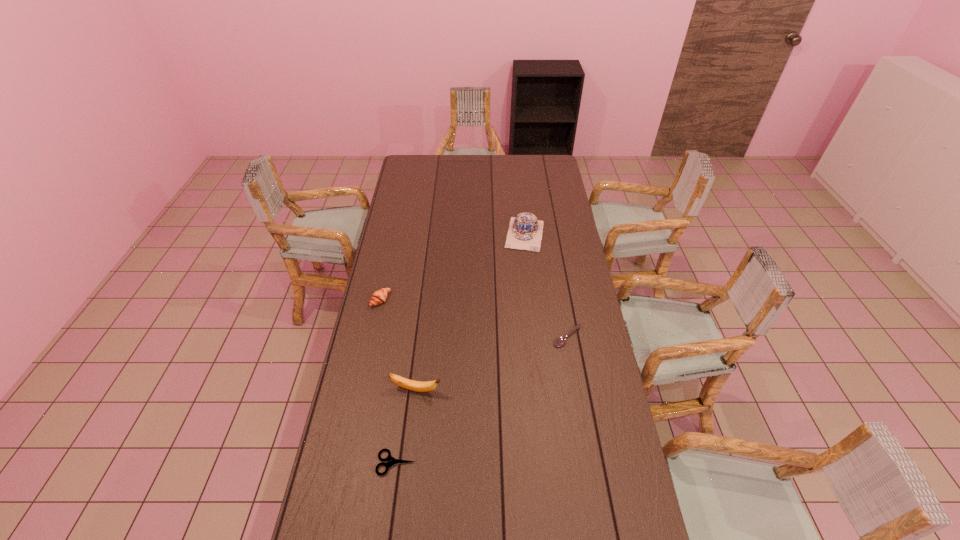
This screenshot has height=540, width=960. What are the coordinates of `vacant area that lies between the shortest object and the farthest object` in the screenshot? It's located at (461, 348).

Where is `free point between the third farthest object and the fourth farthest object`? free point between the third farthest object and the fourth farthest object is located at coordinates (492, 363).

Identify the location of free space that is in between the soupspoon and the fourth farthest object. The width and height of the screenshot is (960, 540). (492, 363).

Locate an element on the screen. This screenshot has width=960, height=540. empty space that is in between the third farthest object and the third tallest object is located at coordinates (474, 319).

Where is `vacant area between the soupspoon and the shortest object`? The width and height of the screenshot is (960, 540). vacant area between the soupspoon and the shortest object is located at coordinates pos(482,400).

Where is `empty location between the pastry and the banana`? The image size is (960, 540). empty location between the pastry and the banana is located at coordinates (398, 345).

Locate an element on the screen. free point between the farthest object and the shears is located at coordinates (461, 348).

You are a GUI agent. You are given a task and a screenshot of the screen. Output one action in this format:
    pyautogui.click(x=<x>, y=<y>)
    Task: Click on the empty location between the second nearest object and the pastry
    
    Given the screenshot: What is the action you would take?
    pyautogui.click(x=398, y=345)

This screenshot has width=960, height=540. What are the coordinates of `free space between the third nearest object and the shears` in the screenshot? It's located at (482, 400).

This screenshot has width=960, height=540. Find the location of `free point between the third shortest object and the third farthest object`. free point between the third shortest object and the third farthest object is located at coordinates (474, 319).